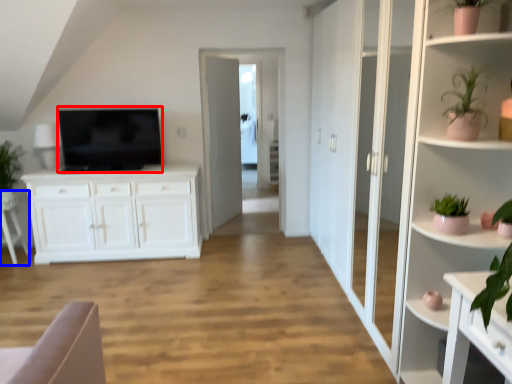
Question: Which of the following is the closest to the observer, television (highlighted by a red box) or armchair (highlighted by a blue box)?

Choices:
 (A) television
 (B) armchair

Answer: (A)